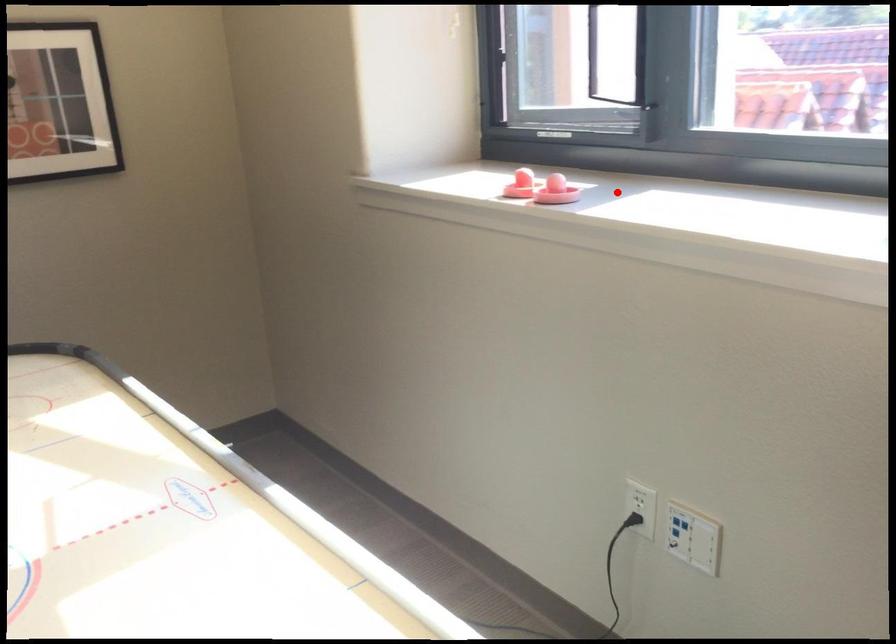
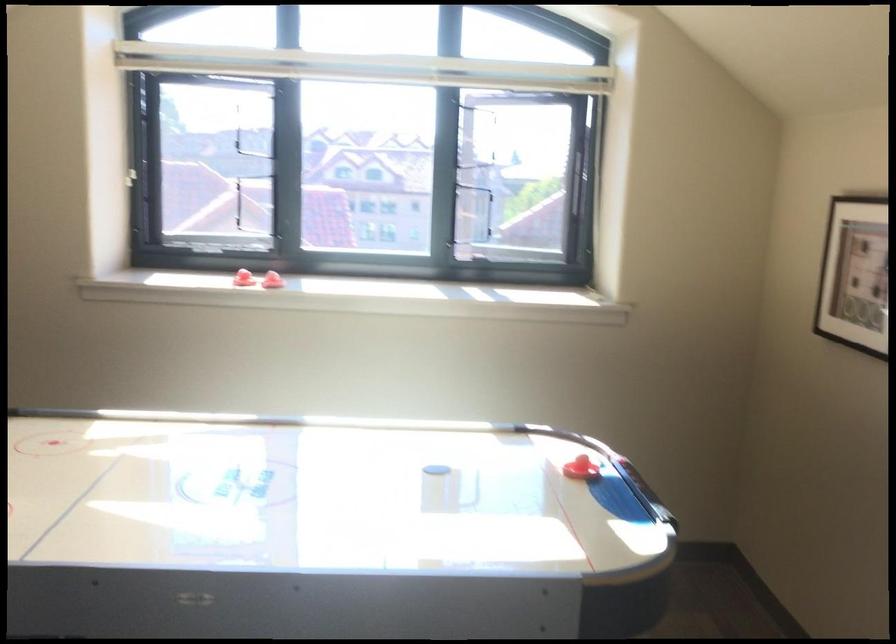
The point at the highlighted location is marked in the first image. Where is the corresponding point in the second image?

(271, 279)